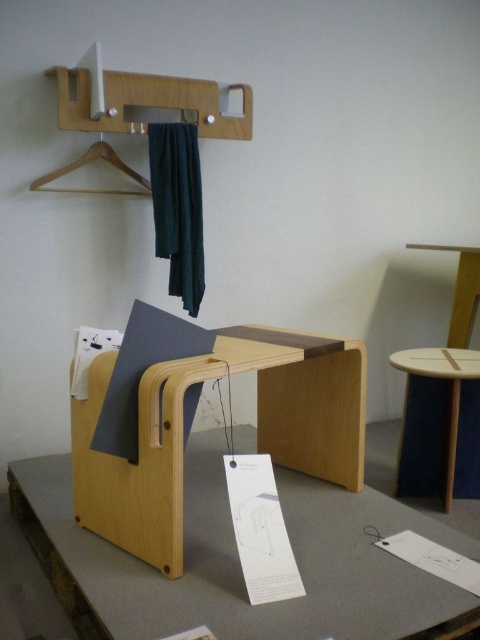
Is point (418, 467) farther from camera compared to point (188, 237)?

No, (418, 467) is in front of (188, 237).

Which is in front, point (454, 362) or point (195, 166)?

Positioned in front is point (454, 362).

Identify the location of matte wood table at center. Image resolution: width=480 pixels, height=640 pixels. (440, 422).

Is point (316, 625) behind point (476, 476)?

No.

Is light wood/wooden table at center to the left of matte wood table at center from the viewer's perspective?

Correct, you'll find light wood/wooden table at center to the left of matte wood table at center.

Image resolution: width=480 pixels, height=640 pixels. Identify the location of light wood/wooden table at center. (239, 563).

Is light wood/finished table at center in front of wooden hanger at upper left?

Yes, it is.

Is light wood/finished table at center thinner than wooden hanger at upper left?

Incorrect, light wood/finished table at center's width is not less than wooden hanger at upper left's.

The height and width of the screenshot is (640, 480). What do you see at coordinates (182, 429) in the screenshot? I see `light wood/finished table at center` at bounding box center [182, 429].

Locate an element on the screen. light wood/finished table at center is located at coordinates (182, 429).